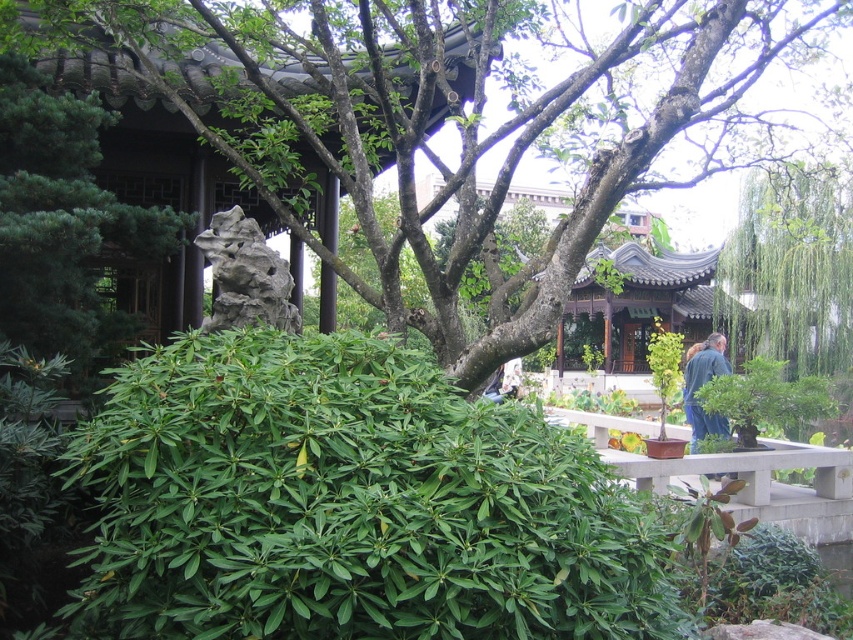
Can you confirm if gray stone rock at center is positioned to the left of blue denim jacket at lower right?

Yes, gray stone rock at center is to the left of blue denim jacket at lower right.

In the scene shown: Which of these two, gray stone rock at center or blue denim jacket at lower right, stands taller?

gray stone rock at center is taller.

You are a GUI agent. You are given a task and a screenshot of the screen. Output one action in this format:
    pyautogui.click(x=<x>, y=<y>)
    Task: Click on the gray stone rock at center
    This screenshot has width=853, height=640.
    Given the screenshot: What is the action you would take?
    pyautogui.click(x=245, y=275)

Who is taller, green leafy bush at lower left or gray stone rock at center?

green leafy bush at lower left is taller.

Does green leafy bush at lower left appear over gray stone rock at center?

Actually, green leafy bush at lower left is below gray stone rock at center.

Image resolution: width=853 pixels, height=640 pixels. What are the coordinates of `green leafy bush at lower left` in the screenshot? It's located at (349, 504).

The image size is (853, 640). I want to click on green leafy bush at lower left, so click(x=349, y=504).

Is point (183, 218) farther from viewer compared to point (799, 394)?

No, (183, 218) is in front of (799, 394).

Between green matte tree at upper left and green leafy bush at right, which one has more height?

With more height is green matte tree at upper left.

Is point (61, 220) less distant than point (775, 420)?

Yes.

Where is `green matte tree at upper left`? green matte tree at upper left is located at coordinates (64, 224).